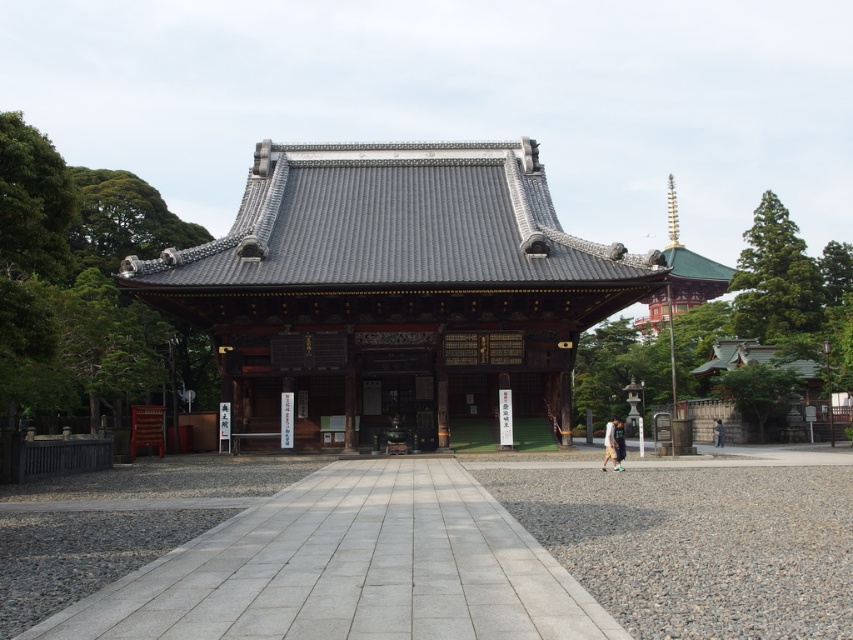
Question: Does shiny dark gray temple at center have a larger size compared to gray gravel at lower center?

Choices:
 (A) no
 (B) yes

Answer: (B)

Question: Which point is farther to the camera?

Choices:
 (A) gray stone path at center
 (B) light brown fabric pants at center
 (C) gray gravel at lower center

Answer: (B)

Question: Is light brown fabric pants at center wider than dark gray fabric jacket at center?

Choices:
 (A) yes
 (B) no

Answer: (A)

Question: Which object is farther from the camera taking this photo?

Choices:
 (A) dark gray fabric jacket at center
 (B) light brown fabric pants at center
 (C) shiny dark gray temple at center
 (D) gray gravel at lower center

Answer: (A)

Question: Which object is closer to the camera taking this photo?

Choices:
 (A) light brown fabric pants at center
 (B) dark gray fabric jacket at center
 (C) gray stone path at center

Answer: (C)

Question: Does gray stone path at center lie behind gray gravel at lower center?

Choices:
 (A) yes
 (B) no

Answer: (B)